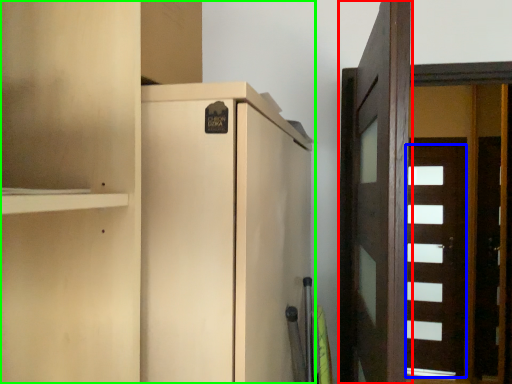
Question: Considering the real-world distances, which object is farthest from door (highlighted by a red box)? door (highlighted by a blue box) or cupboard (highlighted by a green box)?

Choices:
 (A) door
 (B) cupboard

Answer: (A)